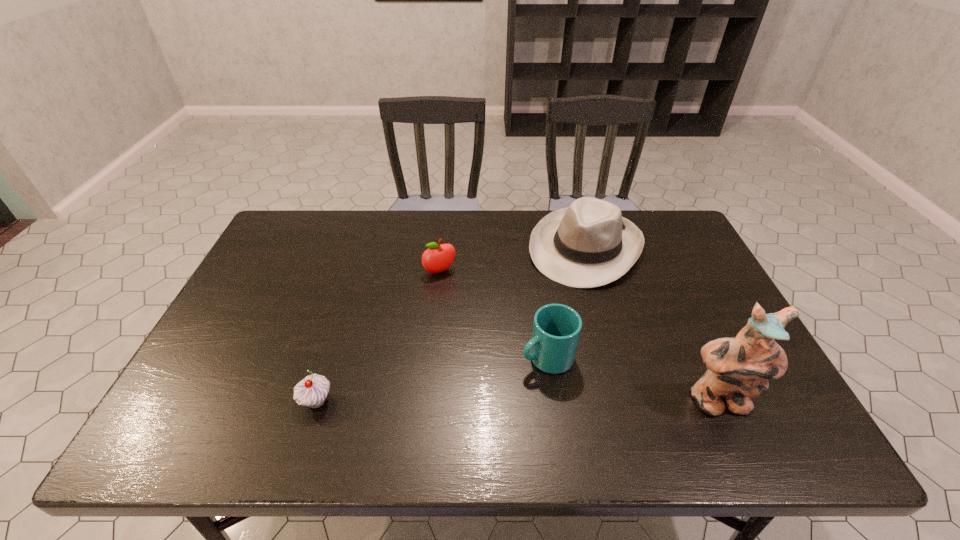
Identify the location of free area in between the fourth object from right to left and the cupcake. (378, 336).

This screenshot has height=540, width=960. I want to click on vacant area between the tallest object and the third nearest object, so click(633, 380).

Where is `empty space that is in between the figurine and the cup`? The image size is (960, 540). empty space that is in between the figurine and the cup is located at coordinates (633, 380).

You are a GUI agent. You are given a task and a screenshot of the screen. Output one action in this format:
    pyautogui.click(x=<x>, y=<y>)
    Task: Click on the free space between the apple and the leftmost object
    The image size is (960, 540).
    Given the screenshot: What is the action you would take?
    pyautogui.click(x=378, y=336)

Identify the location of free space between the fedora and the third nearest object. (566, 302).

This screenshot has height=540, width=960. In order to click on vacant point located between the third nearest object and the cupcake in this screenshot , I will do [x=432, y=379].

Where is `vacant space in between the figurine and the cupcake`? vacant space in between the figurine and the cupcake is located at coordinates (517, 402).

This screenshot has height=540, width=960. Find the location of `free spot between the tallest object and the cup`. free spot between the tallest object and the cup is located at coordinates (633, 380).

Identify which object is located as the nearest to the apple. Please provide its 2D coordinates. Your answer should be formatted as a tuple, i.e. [(x, y)], where the tuple contains the x and y coordinates of a point satisfying the conditions above.

[(589, 244)]

Choose which object is the second nearest neighbor to the third farthest object. Please provide its 2D coordinates. Your answer should be formatted as a tuple, i.e. [(x, y)], where the tuple contains the x and y coordinates of a point satisfying the conditions above.

[(739, 368)]